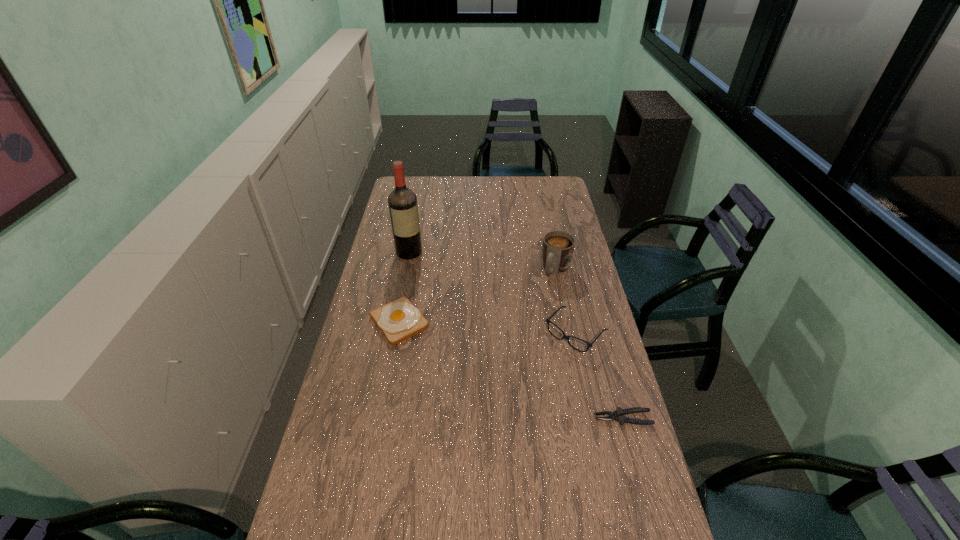
In order to click on free spot on the desktop that is between the toast and the pliers and is positioned on the side of the fourth shortest object with the handle in this screenshot , I will do `click(498, 364)`.

The width and height of the screenshot is (960, 540). What are the coordinates of `vacant space on the desktop that is between the toast and the nearest object and is positioned on the front-facing side of the third shortest object` in the screenshot? It's located at (533, 379).

Where is `free space on the desktop that is between the fourth tallest object and the shortest object and is positioned on the front-facing side of the tallest object`? The height and width of the screenshot is (540, 960). free space on the desktop that is between the fourth tallest object and the shortest object and is positioned on the front-facing side of the tallest object is located at coordinates (485, 359).